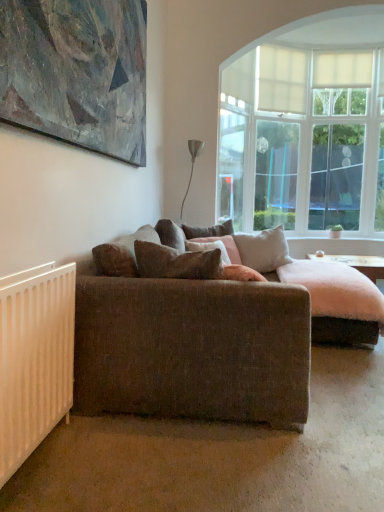
Question: Is white matte radiator at lower left next to light beige fabric pillow at center, arranged as the 2th pillow when viewed from the back?

Choices:
 (A) yes
 (B) no

Answer: (B)

Question: Would you say light beige fabric pillow at center, which is the 3th pillow in front-to-back order, is part of white matte radiator at lower left's contents?

Choices:
 (A) no
 (B) yes

Answer: (A)

Question: Does white matte radiator at lower left have a larger size compared to light beige fabric pillow at center, arranged as the 2th pillow when viewed from the back?

Choices:
 (A) yes
 (B) no

Answer: (B)

Question: Are white matte radiator at lower left and light beige fabric pillow at center, arranged as the 2th pillow when viewed from the back, far apart?

Choices:
 (A) yes
 (B) no

Answer: (A)

Question: Is white matte radiator at lower left oriented towards light beige fabric pillow at center, arranged as the 2th pillow when viewed from the back?

Choices:
 (A) no
 (B) yes

Answer: (A)

Question: Is point (198, 226) positioned closer to the camera than point (352, 170)?

Choices:
 (A) farther
 (B) closer

Answer: (B)

Question: In the image, is brown fabric pillow at center, marked as the 1th pillow in a back-to-front arrangement, positioned in front of or behind translucent glass door at upper right?

Choices:
 (A) behind
 (B) front

Answer: (B)

Question: Is brown fabric pillow at center, the 4th pillow positioned from the front, taller or shorter than translucent glass door at upper right?

Choices:
 (A) short
 (B) tall

Answer: (A)

Question: Looking at the image, does brown fabric pillow at center, the 4th pillow positioned from the front, seem bigger or smaller compared to translucent glass door at upper right?

Choices:
 (A) small
 (B) big

Answer: (A)

Question: Would you say metallic silver lamp at upper center is to the left or to the right of white matte radiator at lower left in the picture?

Choices:
 (A) left
 (B) right

Answer: (B)

Question: From the image's perspective, is metallic silver lamp at upper center positioned above or below white matte radiator at lower left?

Choices:
 (A) below
 (B) above

Answer: (B)

Question: Is point (193, 140) closer or farther from the camera than point (13, 377)?

Choices:
 (A) closer
 (B) farther

Answer: (B)

Question: Is metallic silver lamp at upper center spatially inside white matte radiator at lower left, or outside of it?

Choices:
 (A) inside
 (B) outside

Answer: (B)

Question: Considering the positions of brown fabric pillow at center, which is the 1th pillow from front to back, and brown fabric pillow at center, marked as the 1th pillow in a back-to-front arrangement, in the image, is brown fabric pillow at center, which is the 1th pillow from front to back, taller or shorter than brown fabric pillow at center, marked as the 1th pillow in a back-to-front arrangement,?

Choices:
 (A) short
 (B) tall

Answer: (A)

Question: Is brown fabric pillow at center, which ranks as the 4th pillow in back-to-front order, inside or outside of brown fabric pillow at center, the 4th pillow positioned from the front?

Choices:
 (A) inside
 (B) outside

Answer: (B)